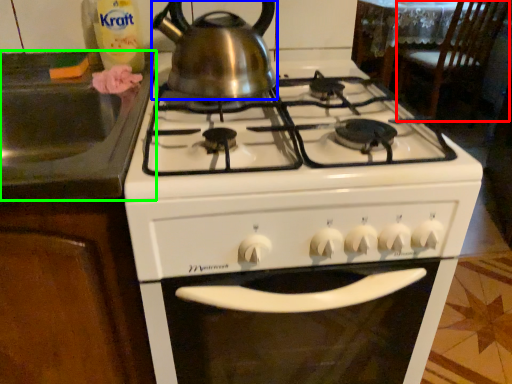
Question: Estimate the real-world distances between objects in this image. Which object is closer to chair (highlighted by a red box), kettle (highlighted by a blue box) or sink (highlighted by a green box)?

Choices:
 (A) kettle
 (B) sink

Answer: (A)